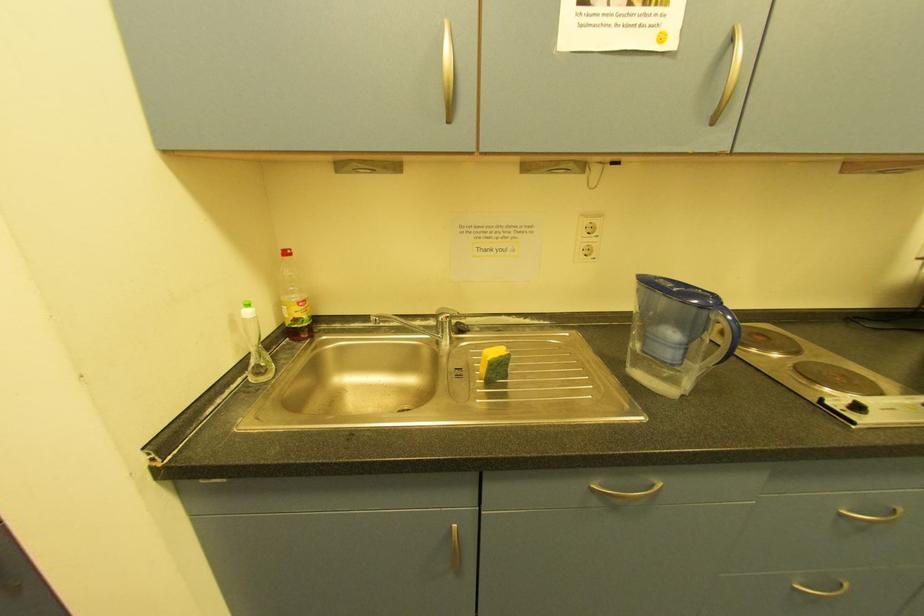
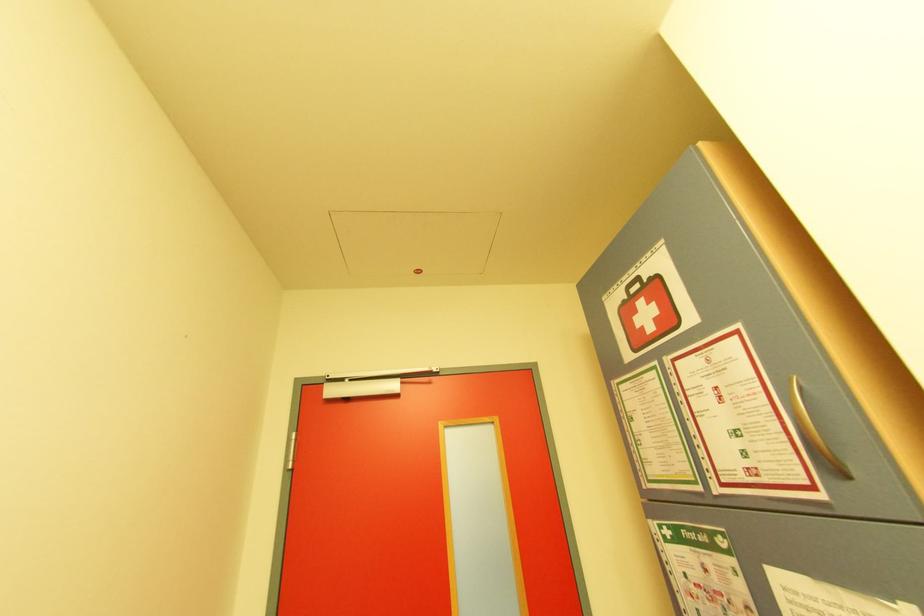
The images are taken continuously from a first-person perspective. In which direction is your viewpoint rotating?

The camera's rotation is toward left-up.